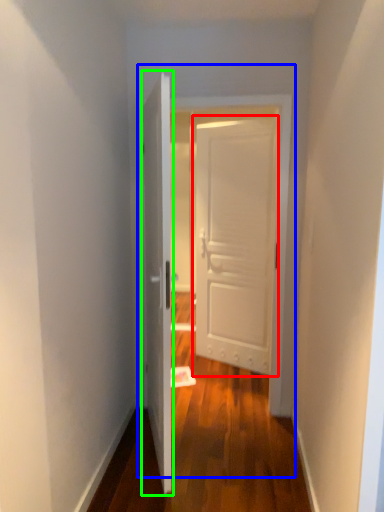
Question: Considering the real-world distances, which object is farthest from door (highlighted by a red box)? door (highlighted by a blue box) or door (highlighted by a green box)?

Choices:
 (A) door
 (B) door

Answer: (B)